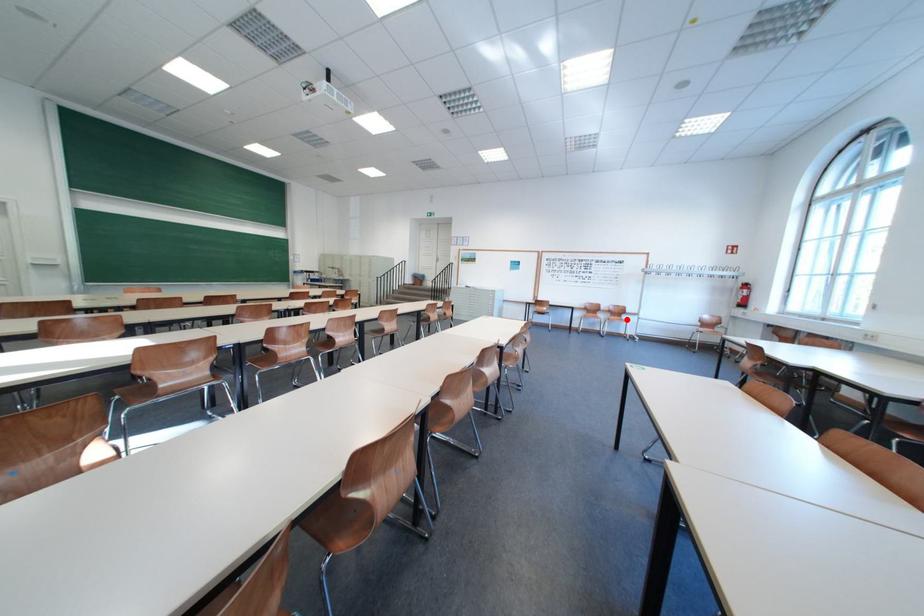
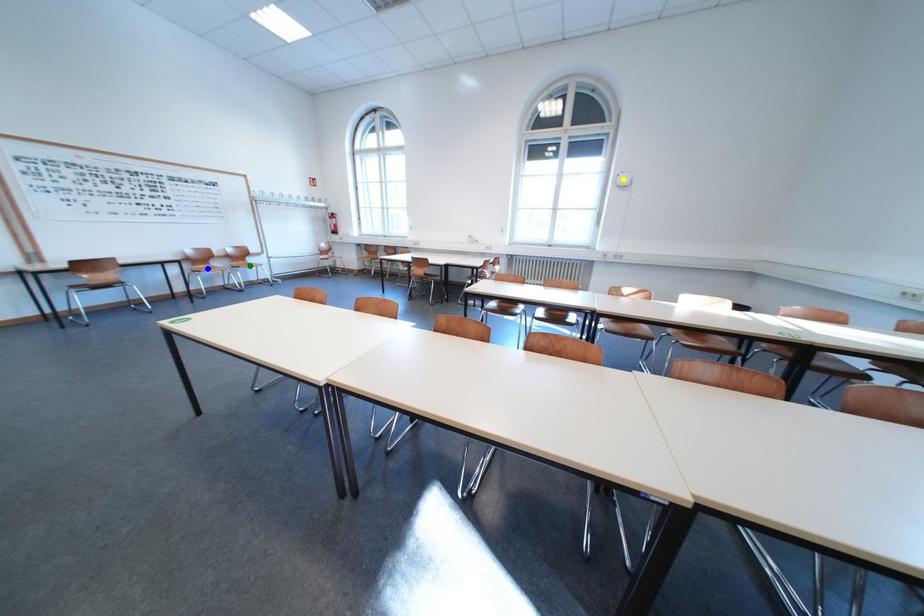
Question: I am providing you with two images of the same scene from different viewpoints. A red point is marked on the first image. You are given multiple points on the second image. Can you choose the point in image 2 that corresponds to the point in image 1?

Choices:
 (A) yellow point
 (B) blue point
 (C) green point

Answer: (C)